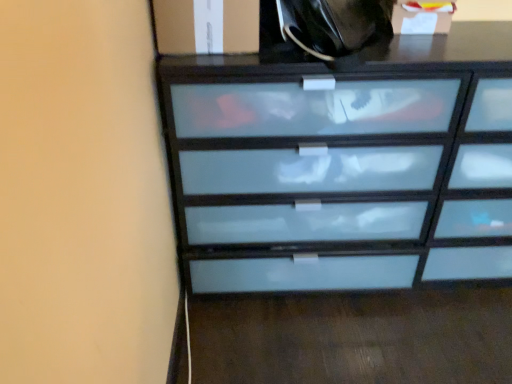
Question: Should I look upward or downward to see black glossy tote bag at upper center?

Choices:
 (A) down
 (B) up

Answer: (B)

Question: Does white frosted glass cabinet at upper right, which is the 2th cabinetry from left to right, have a greater height compared to frosted glass chest of drawers at center?

Choices:
 (A) no
 (B) yes

Answer: (A)

Question: From the image's perspective, does white frosted glass cabinet at upper right, which is the 2th cabinetry from left to right, appear lower than frosted glass chest of drawers at center?

Choices:
 (A) no
 (B) yes

Answer: (A)

Question: Does white frosted glass cabinet at upper right, which is the 2th cabinetry from left to right, have a lesser width compared to frosted glass chest of drawers at center?

Choices:
 (A) no
 (B) yes

Answer: (B)

Question: Is the surface of white frosted glass cabinet at upper right, which is the 2th cabinetry from left to right, in direct contact with frosted glass chest of drawers at center?

Choices:
 (A) yes
 (B) no

Answer: (B)

Question: Considering the relative sizes of white frosted glass cabinet at upper right, which is the 2th cabinetry from left to right, and frosted glass chest of drawers at center in the image provided, is white frosted glass cabinet at upper right, which is the 2th cabinetry from left to right, wider than frosted glass chest of drawers at center?

Choices:
 (A) yes
 (B) no

Answer: (B)

Question: Is the position of white frosted glass cabinet at upper right, which is the 2th cabinetry from left to right, more distant than that of frosted glass chest of drawers at center?

Choices:
 (A) no
 (B) yes

Answer: (B)

Question: Does white frosted glass cabinet at upper left, the second cabinetry when ordered from right to left, have a greater width compared to white frosted glass cabinet at upper right, which is the 2th cabinetry from left to right?

Choices:
 (A) yes
 (B) no

Answer: (A)

Question: Is white frosted glass cabinet at upper left, the second cabinetry when ordered from right to left, in front of white frosted glass cabinet at upper right, positioned as the 1th cabinetry in right-to-left order?

Choices:
 (A) no
 (B) yes

Answer: (B)

Question: Can you confirm if white frosted glass cabinet at upper left, the second cabinetry when ordered from right to left, is thinner than white frosted glass cabinet at upper right, positioned as the 1th cabinetry in right-to-left order?

Choices:
 (A) yes
 (B) no

Answer: (B)

Question: Is white frosted glass cabinet at upper left, placed as the 1th cabinetry when sorted from left to right, beside white frosted glass cabinet at upper right, which is the 2th cabinetry from left to right?

Choices:
 (A) yes
 (B) no

Answer: (B)

Question: Is white frosted glass cabinet at upper left, placed as the 1th cabinetry when sorted from left to right, to the right of white frosted glass cabinet at upper right, which is the 2th cabinetry from left to right, from the viewer's perspective?

Choices:
 (A) no
 (B) yes

Answer: (A)

Question: Can you confirm if white frosted glass cabinet at upper left, the second cabinetry when ordered from right to left, is shorter than white frosted glass cabinet at upper right, which is the 2th cabinetry from left to right?

Choices:
 (A) no
 (B) yes

Answer: (B)

Question: Is white frosted glass cabinet at upper right, positioned as the 1th cabinetry in right-to-left order, smaller than white frosted glass cabinet at upper left, placed as the 1th cabinetry when sorted from left to right?

Choices:
 (A) yes
 (B) no

Answer: (A)